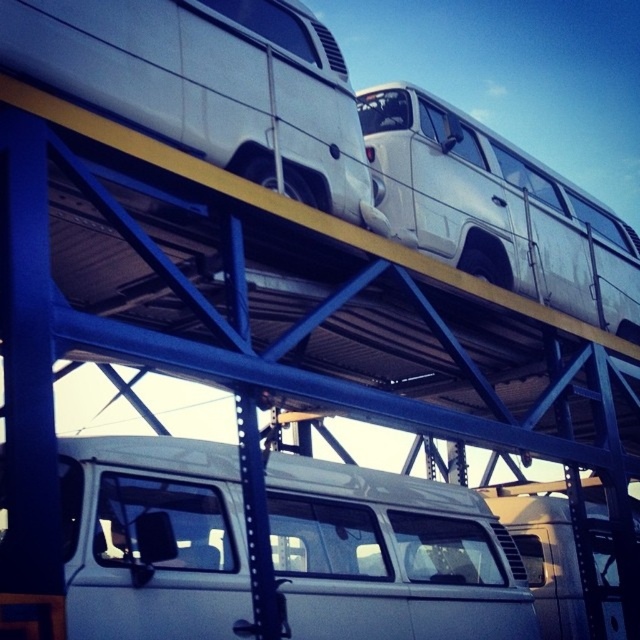
You are a delivery driver who needs to unload packages from both the white matte van at center and the white matte van at upper center. Since you can only access the van that is closer to you, which van should you approach first?

The white matte van at center is in front of the white matte van at upper center, so you should approach the white matte van at center first since it is closer to you.

You are a delivery driver who needs to navigate between the white matte van at center and the white metallic van at upper center on a transport platform. Given that your delivery truck is 10 meters long, can you safely maneuver between them without any part of your truck overlapping the space between them?

The distance between the white matte van at center and the white metallic van at upper center is 10.49 meters. Since your truck is 10 meters long, there is enough space to safely maneuver between them without overlapping.

You are a delivery driver who needs to unload packages from the white matte van at center and the white metallic van at upper center. Which van should you unload first to avoid blocking the other?

You should unload the white metallic van at upper center first because the white matte van at center is positioned under it, so unloading the upper van first will prevent blocking access to the lower one.